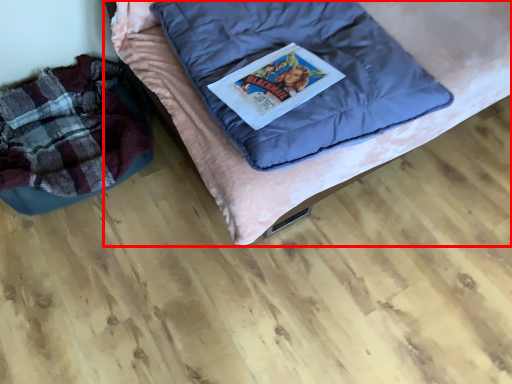
Question: Where is furniture (annotated by the red box) located in relation to bean bag chair in the image?

Choices:
 (A) right
 (B) left

Answer: (A)